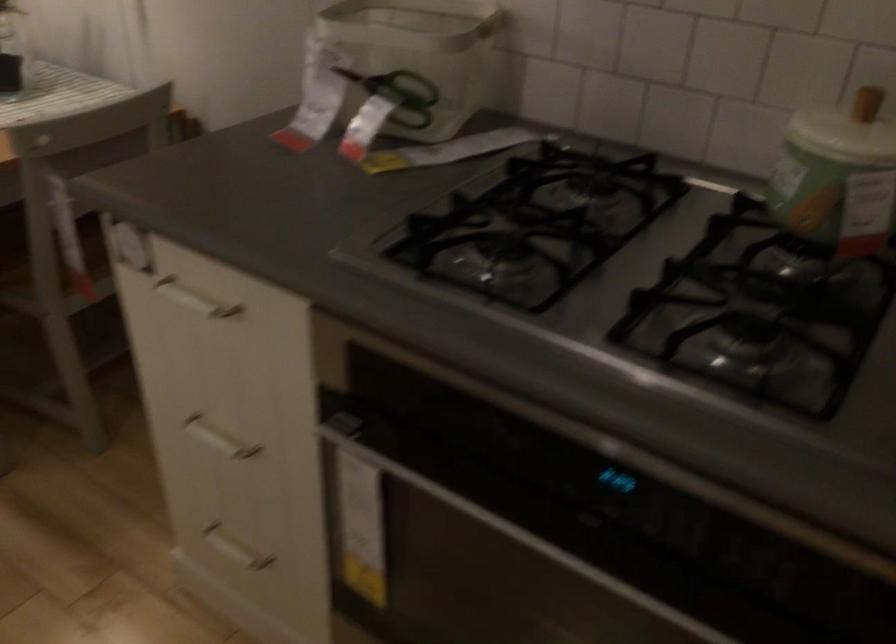
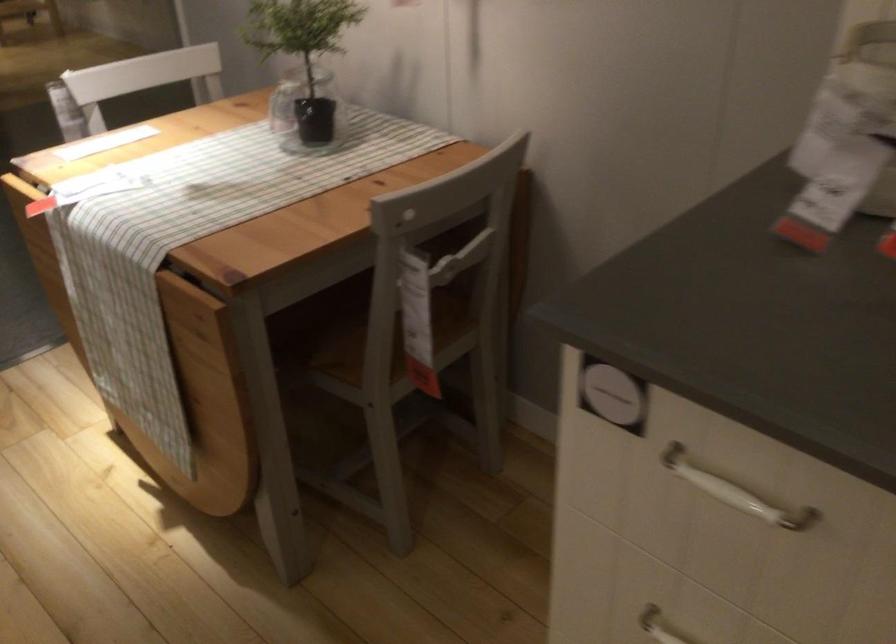
The point at (x=197, y=303) is marked in the first image. Where is the corresponding point in the second image?

(734, 491)